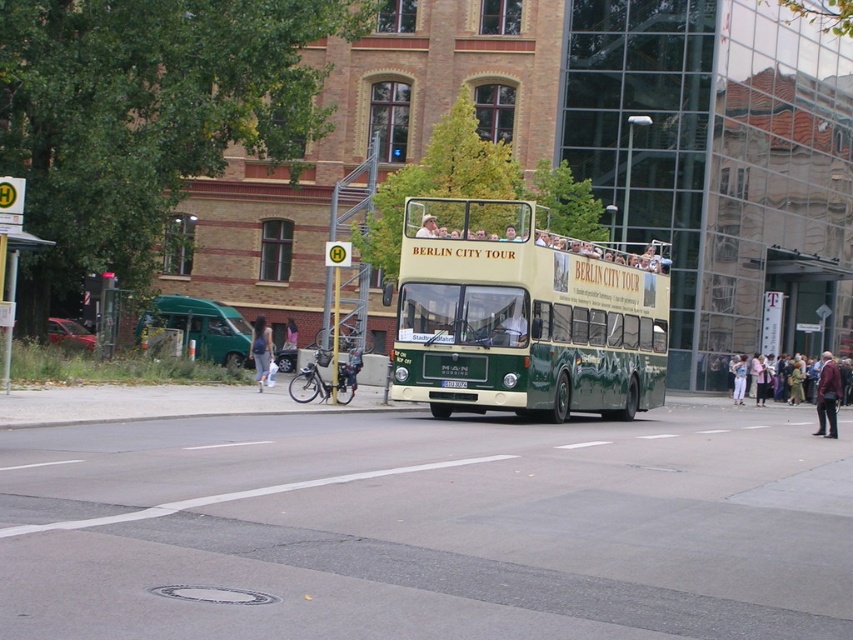
Does maroon leather jacket at lower right have a lesser width compared to denim jacket at center?

No, maroon leather jacket at lower right is not thinner than denim jacket at center.

Does maroon leather jacket at lower right appear on the right side of denim jacket at center?

No, maroon leather jacket at lower right is not to the right of denim jacket at center.

Which is behind, point (828, 426) or point (744, 368)?

Positioned behind is point (744, 368).

At what (x,y) coordinates should I click in order to perform the action: click on maroon leather jacket at lower right. Please return your answer as a coordinate pair (x, y). The height and width of the screenshot is (640, 853). Looking at the image, I should click on 827,396.

Identify the location of green matte double-decker bus at center. This screenshot has height=640, width=853. (524, 316).

Is point (599, 300) farther from viewer compared to point (259, 372)?

No, (599, 300) is closer to viewer.

The height and width of the screenshot is (640, 853). What are the coordinates of `green matte double-decker bus at center` in the screenshot? It's located at (524, 316).

From the picture: Does green matte double-decker bus at center have a greater height compared to denim jacket at center?

Correct, green matte double-decker bus at center is much taller as denim jacket at center.

This screenshot has width=853, height=640. Find the location of `green matte double-decker bus at center`. green matte double-decker bus at center is located at coordinates (524, 316).

Find the location of a particular element. The image size is (853, 640). green matte double-decker bus at center is located at coordinates (524, 316).